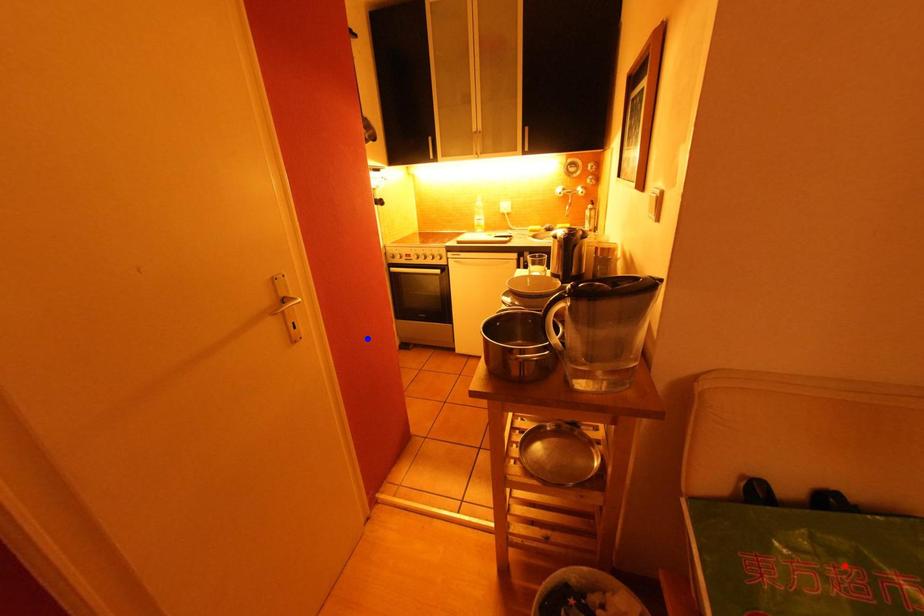
Question: In the image, two points are highlighted. Which point is nearer to the camera? Reply with the corresponding letter.

Choices:
 (A) blue point
 (B) red point

Answer: (B)